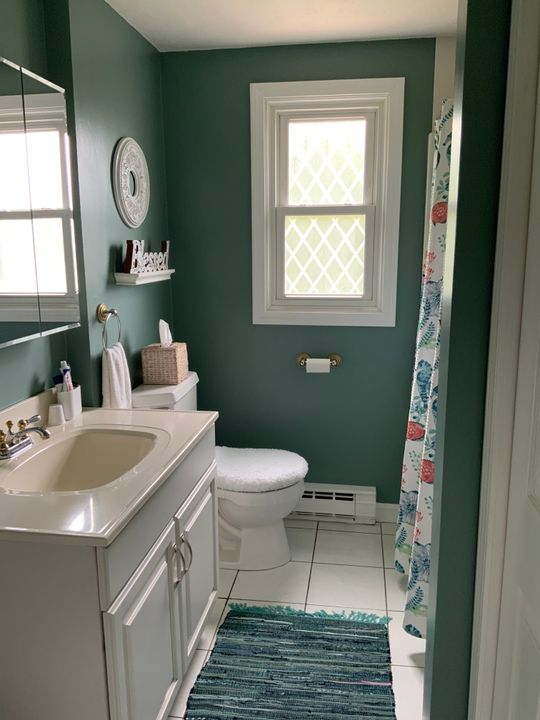
The height and width of the screenshot is (720, 540). What are the coordinates of `partial part left knob` in the screenshot? It's located at (3, 441).